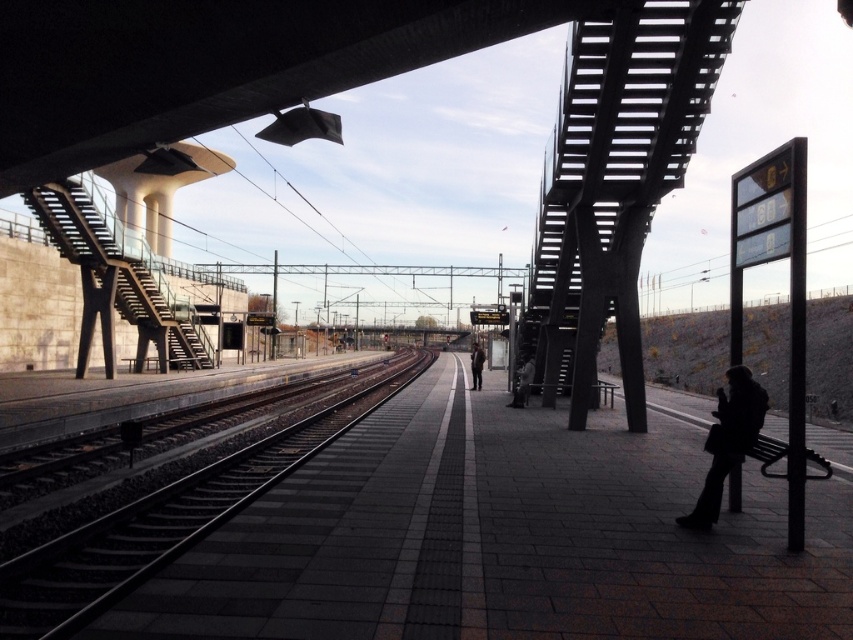
Which is below, black leather coat at lower right or dark gray jacket at center?

Positioned lower is black leather coat at lower right.

Which is in front, point (737, 378) or point (520, 378)?

Positioned in front is point (737, 378).

Find the location of a particular element. black leather coat at lower right is located at coordinates (727, 442).

Who is positioned more to the left, dark gray metal train track at center or dark brown leather jacket at center?

Positioned to the left is dark gray metal train track at center.

Does point (343, 404) come in front of point (473, 374)?

Yes, it is.

Where is `dark gray metal train track at center`? The width and height of the screenshot is (853, 640). dark gray metal train track at center is located at coordinates (163, 524).

Can you confirm if black leather coat at lower right is positioned below dark brown leather jacket at center?

No.

Between black leather coat at lower right and dark brown leather jacket at center, which one appears on the left side from the viewer's perspective?

dark brown leather jacket at center

The image size is (853, 640). I want to click on black leather coat at lower right, so click(x=727, y=442).